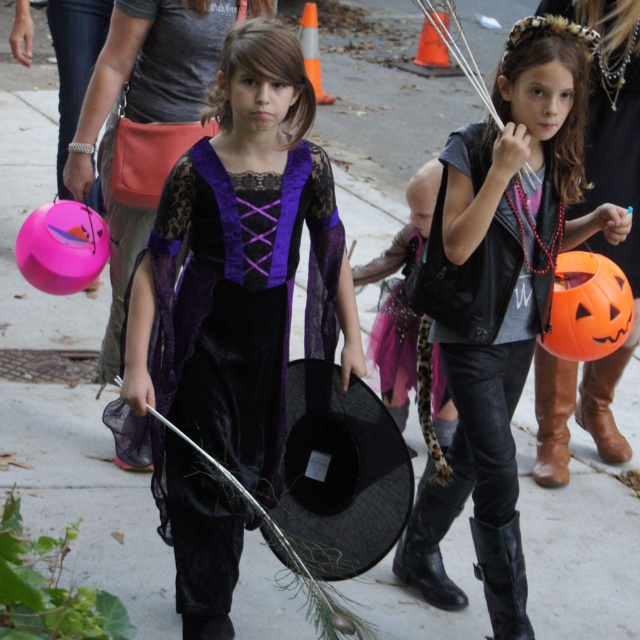
Consider the image. You are a photographer setting up for a Halloween photo shoot. You want to ensure that both the velvet purple dress at center and the velvet black hat at center are clearly visible in the frame. Given their sizes, which one should you focus on first to avoid blurring due to their size differences?

The velvet purple dress at center has a greater height compared to the velvet black hat at center, so you should focus on the velvet purple dress at center first since it is larger and requires more attention to detail to avoid blurring.

What object is located at the coordinates point [410,326] in the Halloween scene?

The point [410,326] indicates the location of the velvet black hat at center.

You are a photographer setting up for a Halloween photoshoot. You need to position a velvet black hat at center and an orange matte pumpkin at right. According to the scene, which object should be placed to the left of the other?

The velvet black hat at center should be placed to the left of the orange matte pumpkin at right because the velvet black hat at center is to the left of orange matte pumpkin at right.